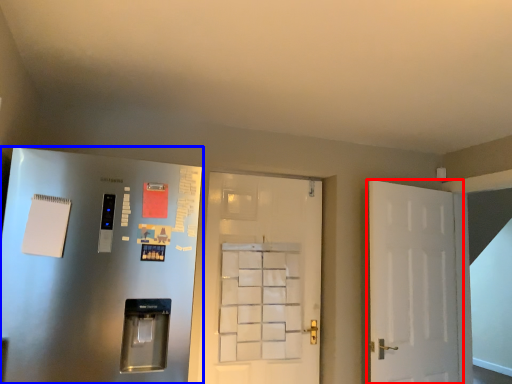
Question: Among these objects, which one is nearest to the camera, door (highlighted by a red box) or door (highlighted by a blue box)?

Choices:
 (A) door
 (B) door

Answer: (B)